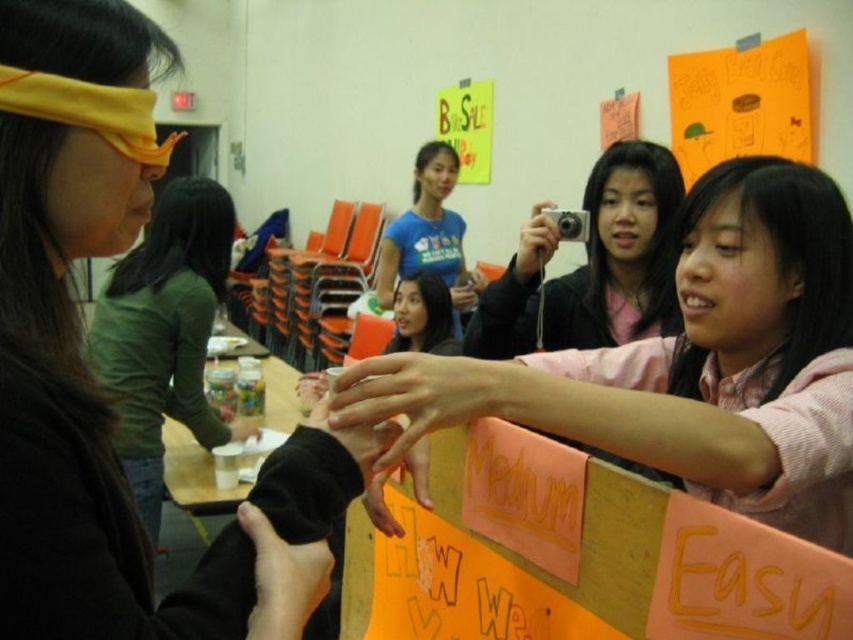
Question: Is orange paper at upper right closer to camera compared to blue t-shirt at center?

Choices:
 (A) yes
 (B) no

Answer: (A)

Question: Which of these objects is positioned farthest from the green matte shirt at left?

Choices:
 (A) pink matte camera at center
 (B) orange paper at upper right
 (C) blue t-shirt at center

Answer: (B)

Question: Which point is closer to the camera taking this photo?

Choices:
 (A) (671, 182)
 (B) (778, 522)
 (C) (196, 192)

Answer: (B)

Question: Which object appears farthest from the camera in this image?

Choices:
 (A) matte yellow blindfold at left
 (B) pink fabric shirt at center
 (C) orange paper at upper right

Answer: (C)

Question: Can you confirm if matte yellow blindfold at left is positioned to the left of pink matte camera at center?

Choices:
 (A) yes
 (B) no

Answer: (A)

Question: Can you confirm if matte yellow blindfold at left is wider than pink matte camera at center?

Choices:
 (A) no
 (B) yes

Answer: (A)